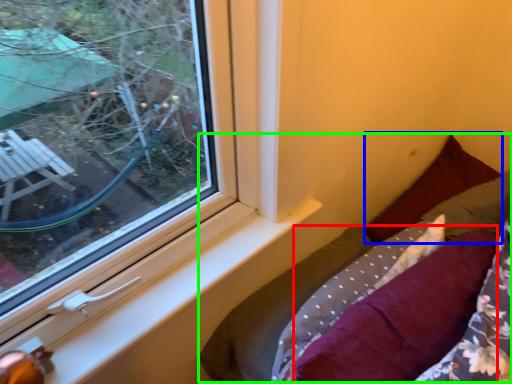
Question: Estimate the real-world distances between objects in this image. Which object is closer to pillow (highlighted by a red box), pillow (highlighted by a blue box) or bed (highlighted by a green box)?

Choices:
 (A) pillow
 (B) bed

Answer: (B)